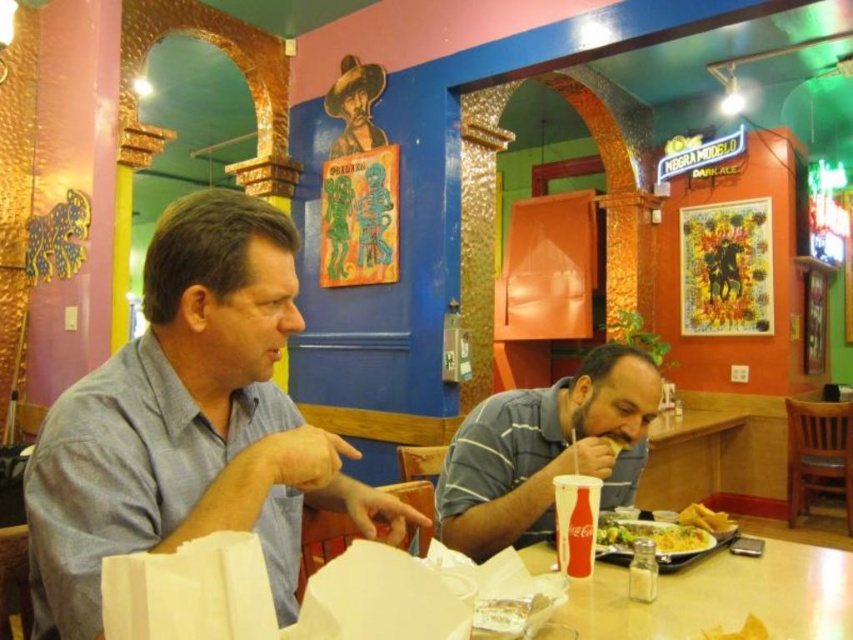
You are a customer at the restaurant and want to place a napkin on the table. You have a white paper cup at lower center and a yellow matte tortilla at lower center. Which item can you use as a makeshift napkin?

The yellow matte tortilla at lower center can be used as a makeshift napkin because it is shorter than the white paper cup at lower center, making it flatter and more suitable for holding or covering items.

You are a customer at the restaurant and want to place your yellow tortilla chips at lower right closer to the plastic disposable plate at center. Which direction should you move them?

You should move the yellow tortilla chips at lower right to the left to place them closer to the plastic disposable plate at center since the plate is to the left of the chips.